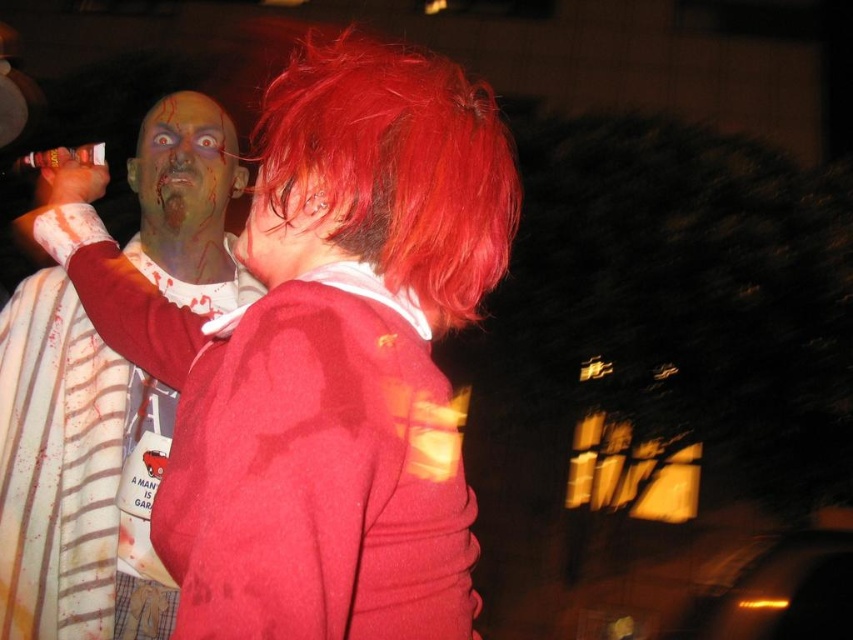
Question: Which point appears farthest from the camera in this image?

Choices:
 (A) (0, 417)
 (B) (225, 584)
 (C) (323, 211)
 (D) (180, 173)

Answer: (D)

Question: Can you confirm if matte red wig at upper center is smaller than greenish matte face at upper left?

Choices:
 (A) yes
 (B) no

Answer: (B)

Question: Can you confirm if matte red wig at upper center is bigger than matte white shirt at left?

Choices:
 (A) yes
 (B) no

Answer: (A)

Question: Which object is positioned closest to the matte white shirt at left?

Choices:
 (A) greenish matte face at upper left
 (B) matte red wig at upper center

Answer: (A)

Question: Can you confirm if greenish matte face at upper left is thinner than smooth red wig at center?

Choices:
 (A) no
 (B) yes

Answer: (A)

Question: Among these points, which one is farthest from the camera?

Choices:
 (A) (463, 620)
 (B) (16, 333)

Answer: (B)